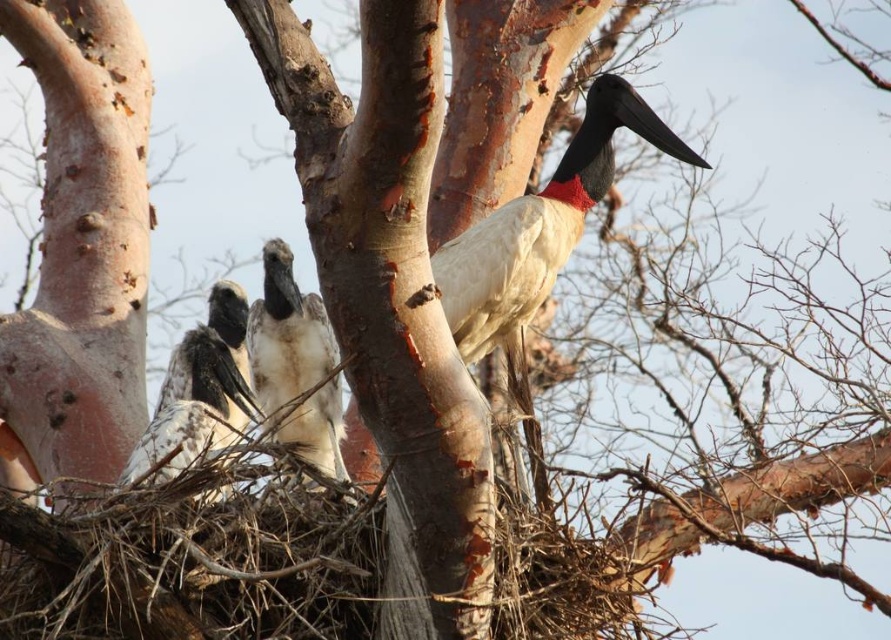
Question: Is white feathered bird at center closer to the viewer compared to white feathered bird at left?

Choices:
 (A) yes
 (B) no

Answer: (B)

Question: Is white feathered bird at center bigger than white feathered bird at left?

Choices:
 (A) yes
 (B) no

Answer: (B)

Question: Does white feathered bird at center appear over white feathered bird at left?

Choices:
 (A) no
 (B) yes

Answer: (B)

Question: Which of the following is the closest to the observer?

Choices:
 (A) white feathered bird at center
 (B) white feathered bird at left

Answer: (B)